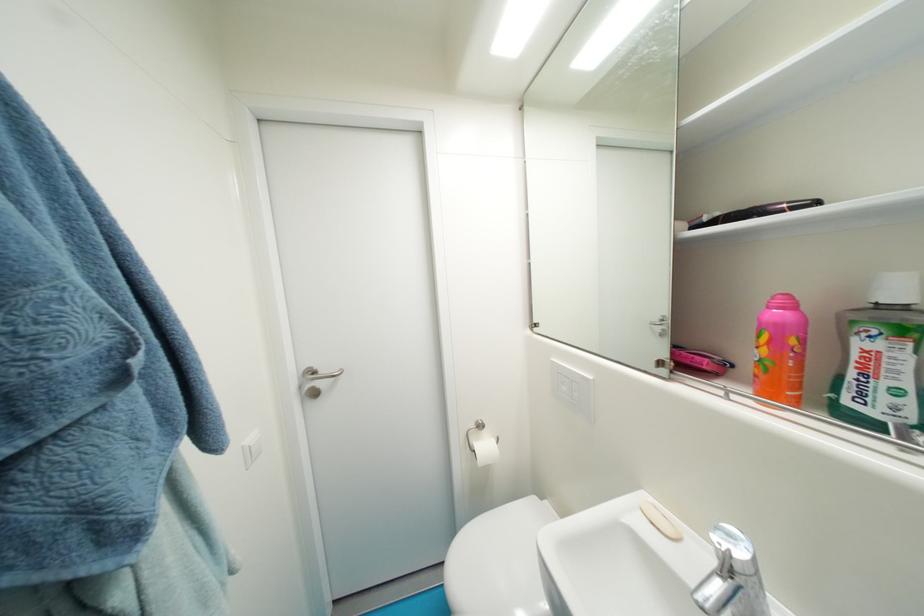
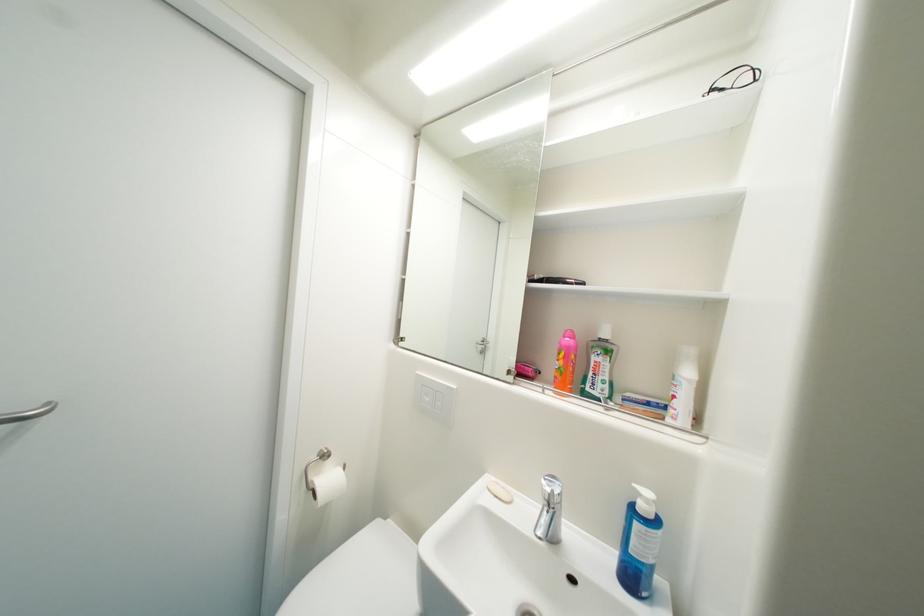
Locate, in the second image, the point that corresponds to point (492, 448) in the first image.

(337, 482)